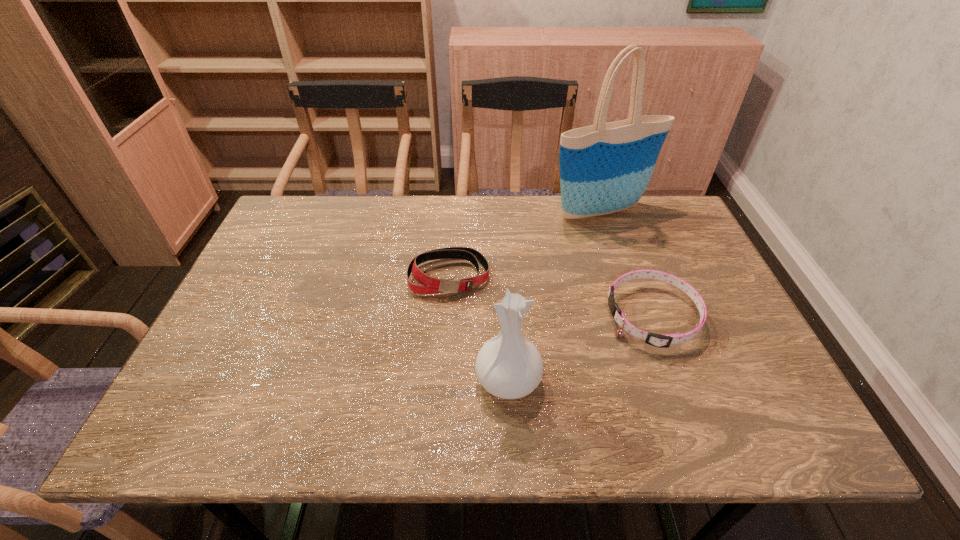
In order to click on free point located 0.310m with the buckle on the shorter dog collar in this screenshot , I will do `click(481, 316)`.

Find the location of a particular element. vacant space located with the buckle on the shorter dog collar is located at coordinates (583, 316).

I want to click on object present at the far edge, so (605, 168).

The height and width of the screenshot is (540, 960). Find the location of `object that is at the near edge`. object that is at the near edge is located at coordinates pyautogui.click(x=509, y=366).

In order to click on tote bag situated at the right edge in this screenshot , I will do `click(605, 168)`.

At what (x,y) coordinates should I click in order to perform the action: click on dog collar present at the right edge. Please return your answer as a coordinate pair (x, y). Image resolution: width=960 pixels, height=540 pixels. Looking at the image, I should click on (662, 341).

This screenshot has height=540, width=960. I want to click on object that is at the far right corner, so click(x=605, y=168).

Locate an element on the screen. The image size is (960, 540). free space at the far edge is located at coordinates (467, 214).

What are the coordinates of `free space at the near edge of the desktop` in the screenshot? It's located at (352, 423).

In the image, there is a desktop. In order to click on vacant space at the left edge in this screenshot , I will do `click(264, 279)`.